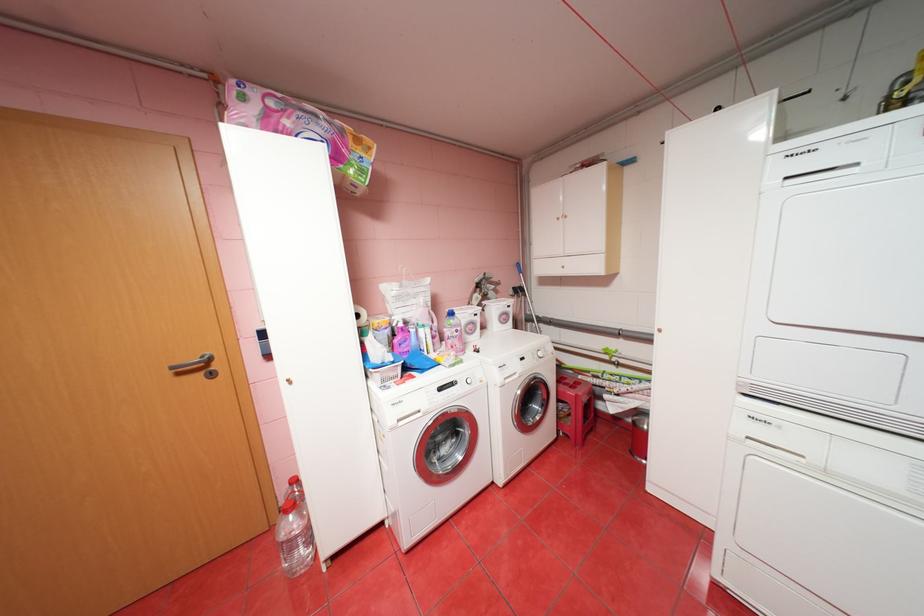
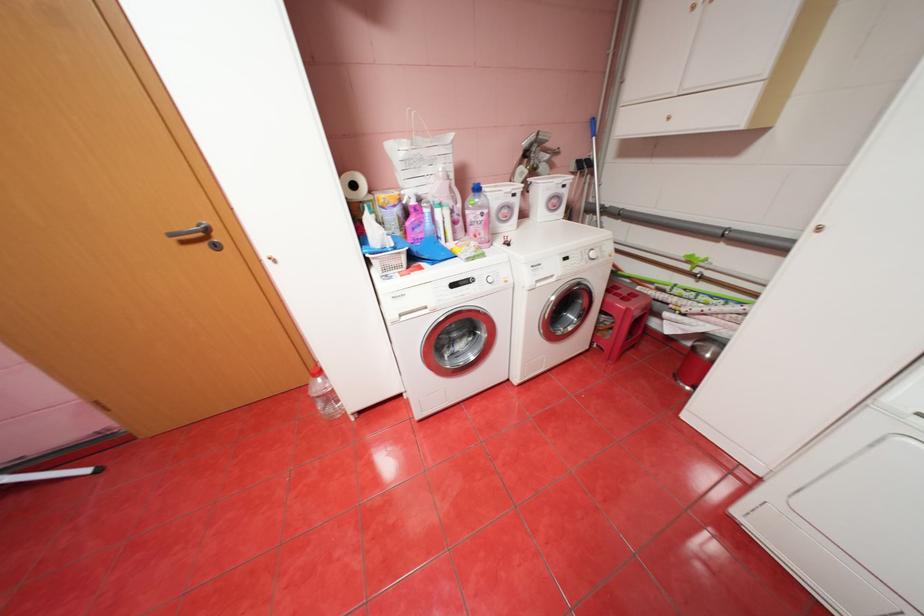
Question: I am providing you with two images of the same scene from different viewpoints. Which of the following objects are not visible in image2?

Choices:
 (A) gold cabinet knob
 (B) detergent drawer handle
 (C) washing machine door handle
 (D) none of these

Answer: (D)